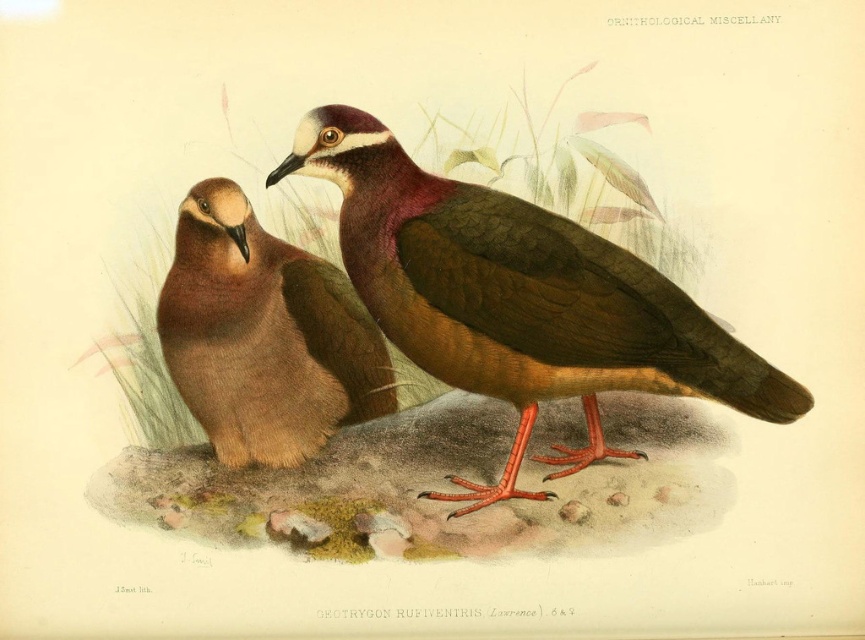
You are an ornithologist examining the illustration. You notice two birds in the image. Based on their size, which one is more likely to be the adult of the species? Please refer to the brown matte bird at center and the brown matte pigeon at left in your answer.

The brown matte bird at center is larger than the brown matte pigeon at left, so it is more likely to be the adult of the species.